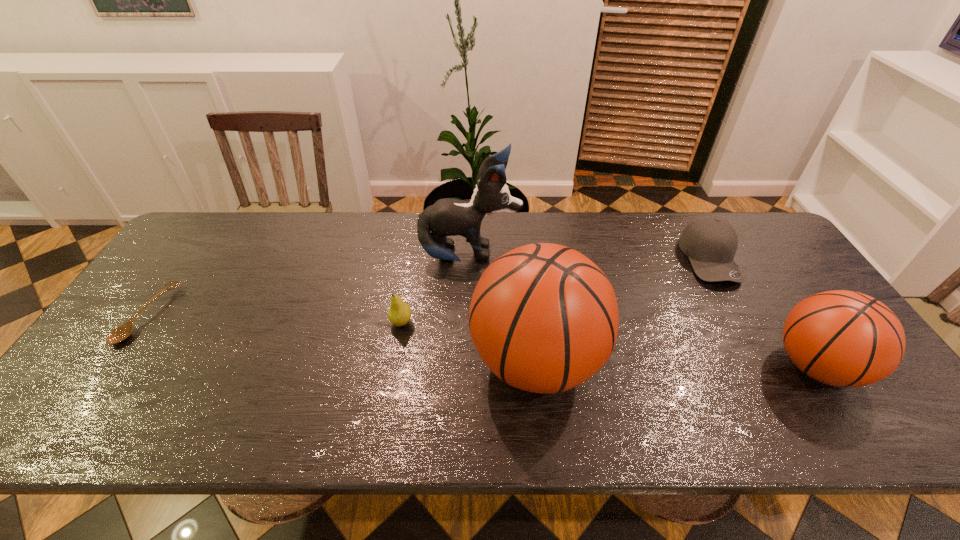
Identify the location of empty space between the baseball cap and the puppy. This screenshot has width=960, height=540. (590, 258).

I want to click on free spot between the pear and the puppy, so click(x=436, y=289).

Locate an element on the screen. This screenshot has width=960, height=540. free space between the right basketball and the puppy is located at coordinates (642, 312).

I want to click on free space between the leftmost object and the taller basketball, so click(342, 338).

What are the coordinates of `empty space between the leftmost object and the left basketball` in the screenshot? It's located at (342, 338).

Locate which object is the closest to the baseball cap. Please provide its 2D coordinates. Your answer should be formatted as a tuple, i.e. [(x, y)], where the tuple contains the x and y coordinates of a point satisfying the conditions above.

[(842, 338)]

Identify which object is the second nearest to the shortest object. Please provide its 2D coordinates. Your answer should be formatted as a tuple, i.e. [(x, y)], where the tuple contains the x and y coordinates of a point satisfying the conditions above.

[(446, 217)]

Image resolution: width=960 pixels, height=540 pixels. What are the coordinates of `free point that satisfies the following two spatial constraints: 1. on the front side of the shorter basketball; 2. on the right side of the taller basketball` in the screenshot? It's located at (537, 367).